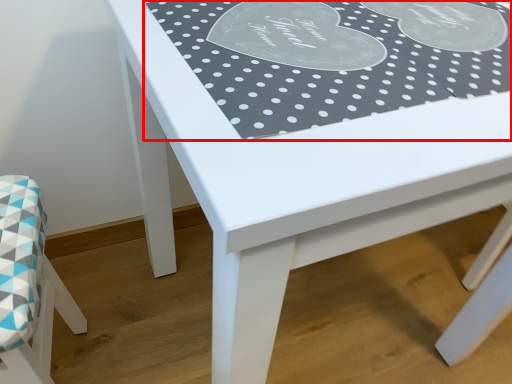
Question: From the image's perspective, where is tablecloth (annotated by the red box) located in relation to chair in the image?

Choices:
 (A) below
 (B) above

Answer: (B)